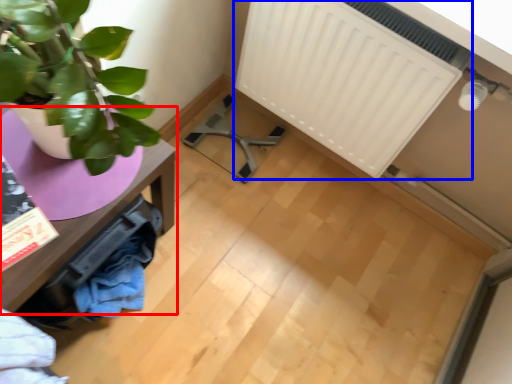
Question: Which of the following is the closest to the observer, table (highlighted by a red box) or radiator (highlighted by a blue box)?

Choices:
 (A) table
 (B) radiator

Answer: (A)